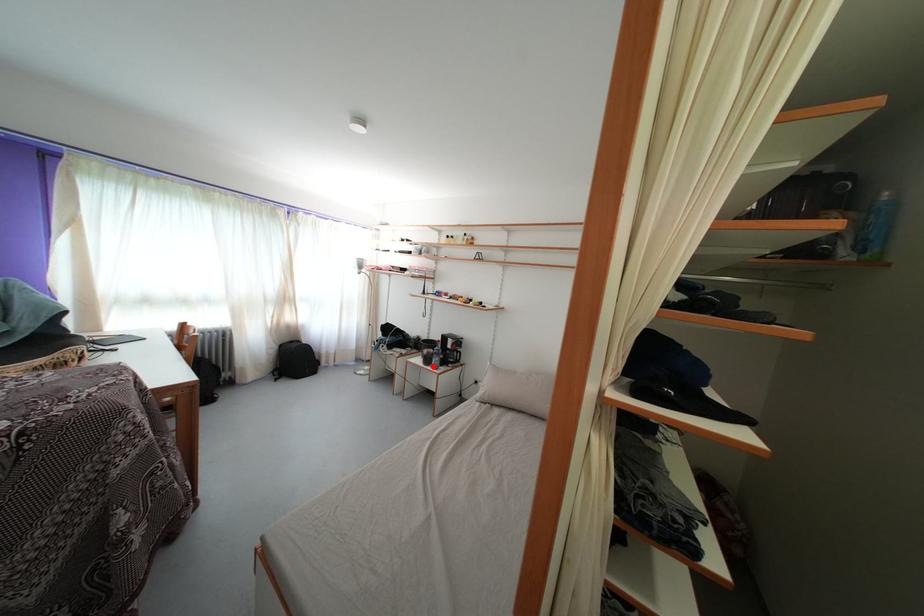
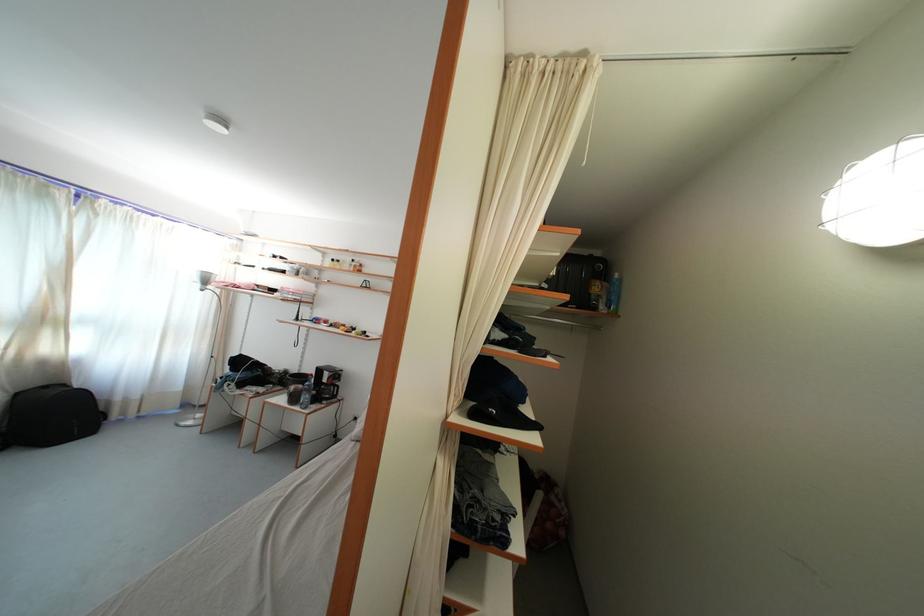
Question: I am providing you with two images of the same scene from different viewpoints. Image1 has a red point marked. In image2, the corresponding 3D location appears at what relative position? Reply with the corresponding letter.

Choices:
 (A) Closer
 (B) Farther

Answer: (A)